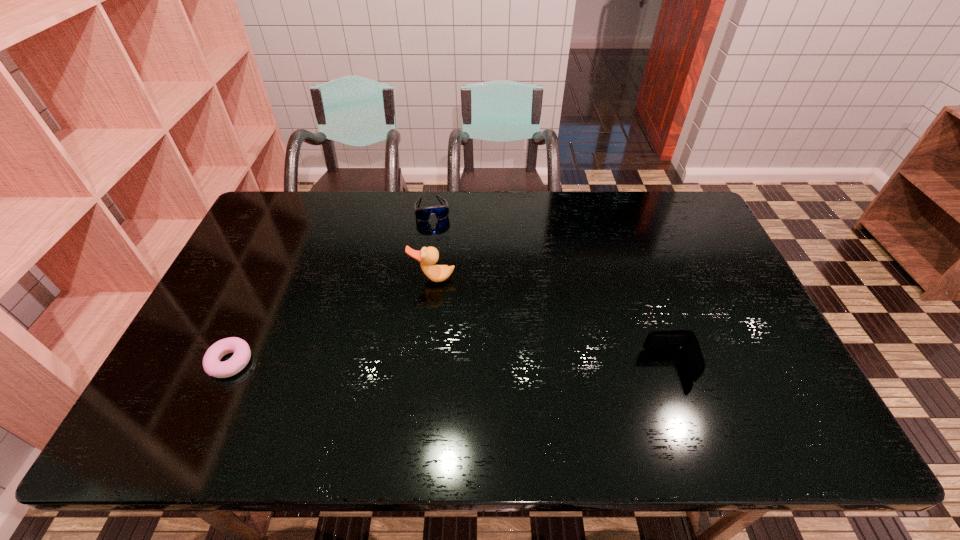
Identify the location of wallet that is at the near edge. The width and height of the screenshot is (960, 540). (685, 340).

Find the location of a particular element. object that is positioned at the left edge is located at coordinates (212, 366).

The height and width of the screenshot is (540, 960). Find the location of `object located at the near left corner`. object located at the near left corner is located at coordinates (212, 366).

Where is `vacant region at the far edge of the desktop`? Image resolution: width=960 pixels, height=540 pixels. vacant region at the far edge of the desktop is located at coordinates pyautogui.click(x=557, y=205).

The width and height of the screenshot is (960, 540). I want to click on vacant space at the near edge, so click(636, 389).

The image size is (960, 540). Find the location of `vacant space at the left edge of the desktop`. vacant space at the left edge of the desktop is located at coordinates (278, 257).

In the image, there is a desktop. Where is `vacant space at the right edge`? The width and height of the screenshot is (960, 540). vacant space at the right edge is located at coordinates (707, 249).

At what (x,y) coordinates should I click in order to perform the action: click on vacant point at the far left corner. Please return your answer as a coordinate pair (x, y). Looking at the image, I should click on (275, 192).

Locate an element on the screen. This screenshot has height=540, width=960. vacant space at the far right corner of the desktop is located at coordinates [x=662, y=217].

The image size is (960, 540). I want to click on vacant space at the near right corner of the desktop, so click(x=769, y=384).